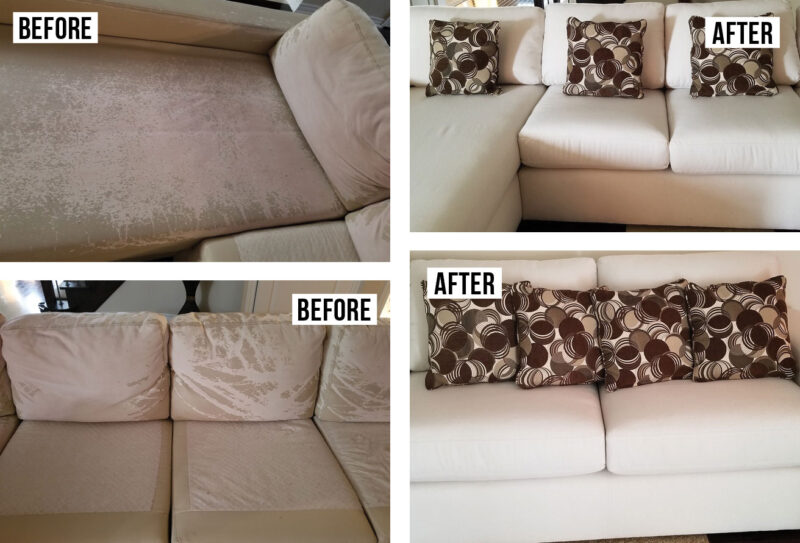
I want to click on art piece, so click(190, 301).